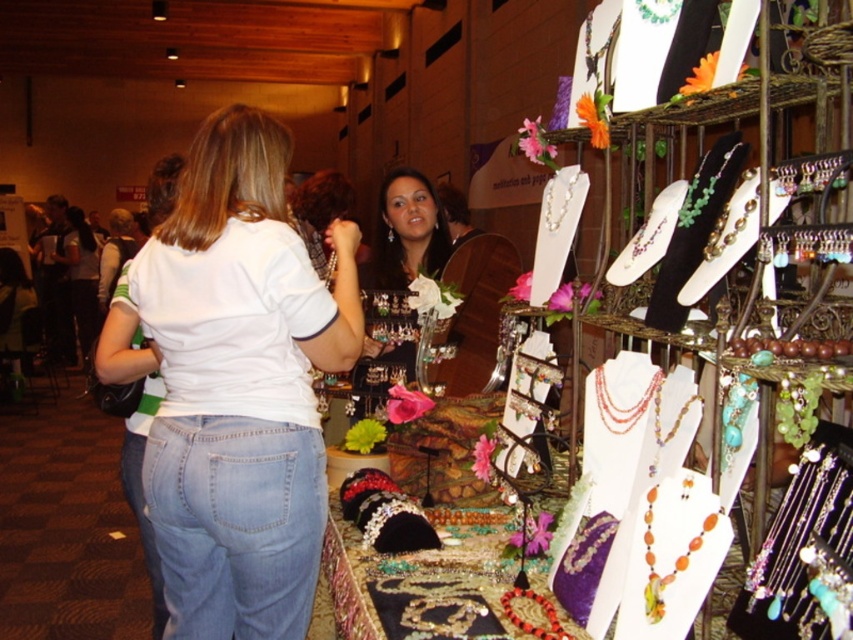
You are a customer at the jewelry stall and you want to find the orange coral necklace at center. Where should you look relative to the white matte shirt at upper left?

Result: The orange coral necklace at center is to the right of the white matte shirt at upper left.

You are a photographer at the fair and want to capture the white cotton shirt at center and denim at center in a single shot. Which clothing item should you focus on first to ensure both are in frame without moving the camera?

You should focus on the white cotton shirt at center first since the denim at center is behind it, ensuring both will be in the frame without needing to adjust the camera position.